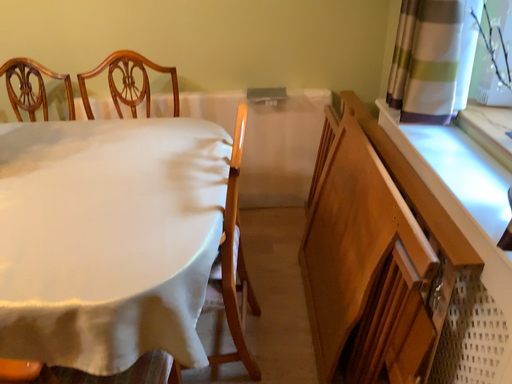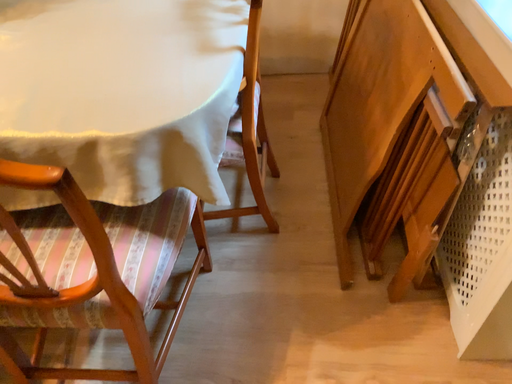
Question: Which way did the camera rotate in the video?

Choices:
 (A) rotated downward
 (B) rotated upward

Answer: (A)